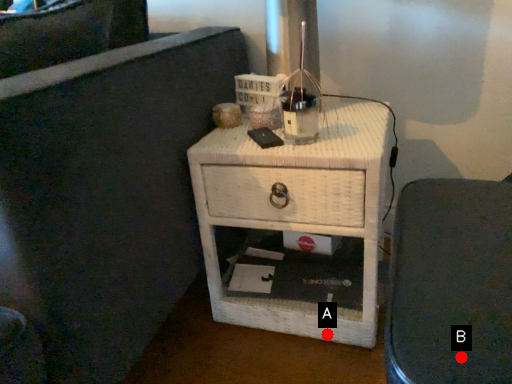
Question: Two points are circled on the image, labeled by A and B beside each circle. Which of the following is the farthest from the observer?

Choices:
 (A) A is further
 (B) B is further

Answer: (A)